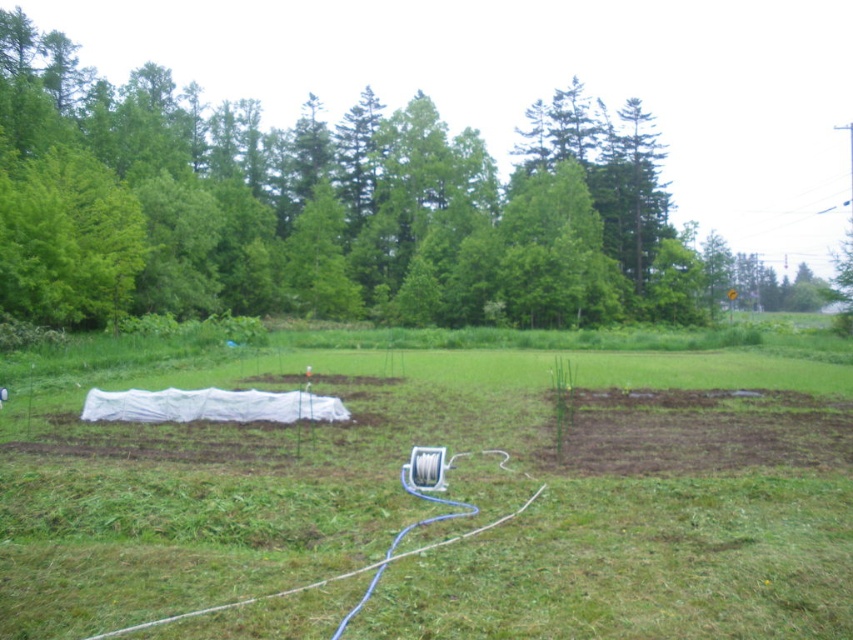
Question: Is white fabric at center smaller than green leafy tree at upper center?

Choices:
 (A) no
 (B) yes

Answer: (B)

Question: Is white fabric at center above green leafy tree at upper center?

Choices:
 (A) yes
 (B) no

Answer: (B)

Question: Is the position of white fabric at center more distant than that of green leafy tree at upper center?

Choices:
 (A) no
 (B) yes

Answer: (A)